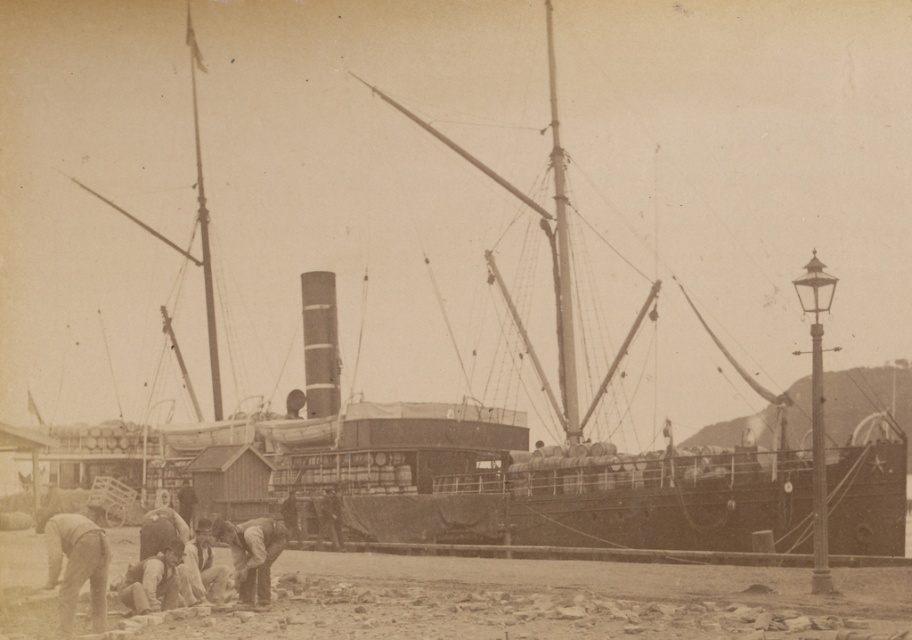
You are an observer standing at the port looking at the scene. You notice two items at the lower left corner of the image. Which one is positioned more to the left between the smooth beige pants at lower left and the light brown leather boots at lower left?

The smooth beige pants at lower left is positioned more to the left than the light brown leather boots at lower left according to the description.

You are standing at the point closest to the ship in the image. Which of the two points, point (216, 378) or point (130, 596), is farther away from you?

Point (216, 378) is behind point (130, 596), so it is farther away from you.